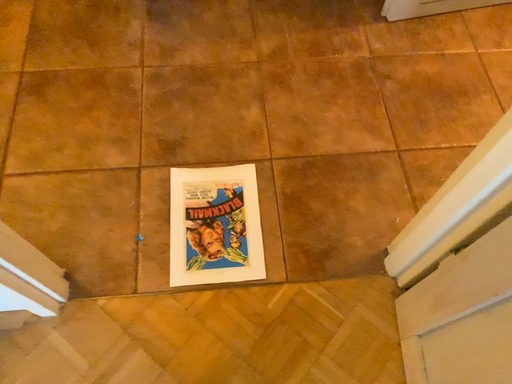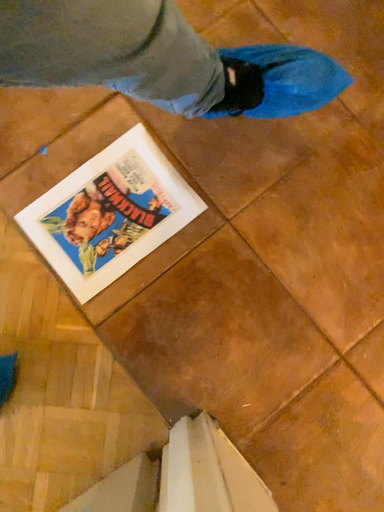
Question: Which way did the camera rotate in the video?

Choices:
 (A) rotated right
 (B) rotated left

Answer: (B)